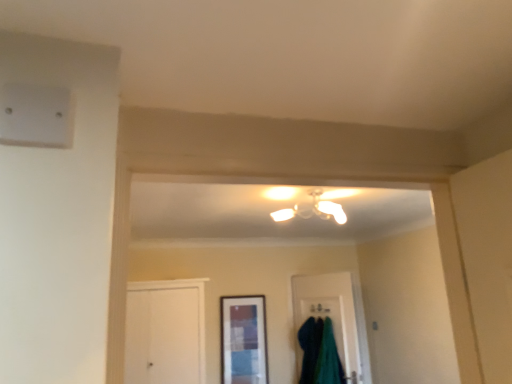
Question: Should I look upward or downward to see teal fuzzy robe at lower center?

Choices:
 (A) down
 (B) up

Answer: (A)

Question: Would you say matte white chandelier at center is a long distance from teal fuzzy robe at lower center?

Choices:
 (A) yes
 (B) no

Answer: (A)

Question: Is matte white chandelier at center at the left side of teal fuzzy robe at lower center?

Choices:
 (A) yes
 (B) no

Answer: (A)

Question: Considering the relative positions of matte white chandelier at center and teal fuzzy robe at lower center in the image provided, is matte white chandelier at center to the right of teal fuzzy robe at lower center from the viewer's perspective?

Choices:
 (A) no
 (B) yes

Answer: (A)

Question: Is matte white chandelier at center smaller than teal fuzzy robe at lower center?

Choices:
 (A) no
 (B) yes

Answer: (B)

Question: From the image's perspective, would you say matte white chandelier at center is positioned over teal fuzzy robe at lower center?

Choices:
 (A) yes
 (B) no

Answer: (A)

Question: From a real-world perspective, is matte white chandelier at center on top of teal fuzzy robe at lower center?

Choices:
 (A) yes
 (B) no

Answer: (A)

Question: Is the surface of matte white chandelier at center in direct contact with matte glass window at center?

Choices:
 (A) no
 (B) yes

Answer: (A)

Question: Is matte white chandelier at center aimed at matte glass window at center?

Choices:
 (A) yes
 (B) no

Answer: (B)

Question: Is matte white chandelier at center surrounding matte glass window at center?

Choices:
 (A) no
 (B) yes

Answer: (A)

Question: Is matte white chandelier at center oriented away from matte glass window at center?

Choices:
 (A) no
 (B) yes

Answer: (A)

Question: Considering the relative positions of matte white chandelier at center and matte glass window at center in the image provided, is matte white chandelier at center behind matte glass window at center?

Choices:
 (A) yes
 (B) no

Answer: (B)

Question: Is matte white chandelier at center located outside matte glass window at center?

Choices:
 (A) yes
 (B) no

Answer: (A)

Question: Considering the relative sizes of teal fuzzy robe at lower center and matte glass window at center in the image provided, is teal fuzzy robe at lower center thinner than matte glass window at center?

Choices:
 (A) no
 (B) yes

Answer: (A)